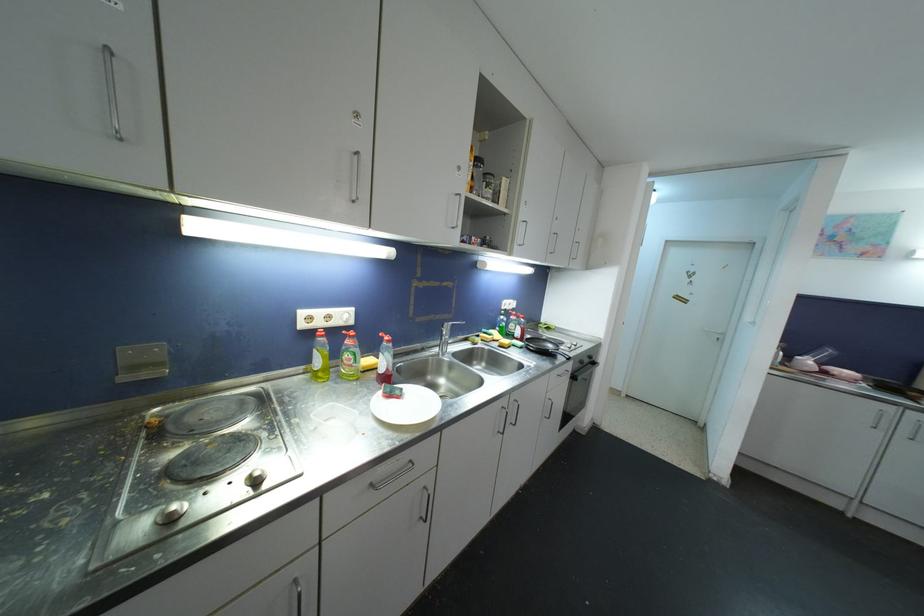
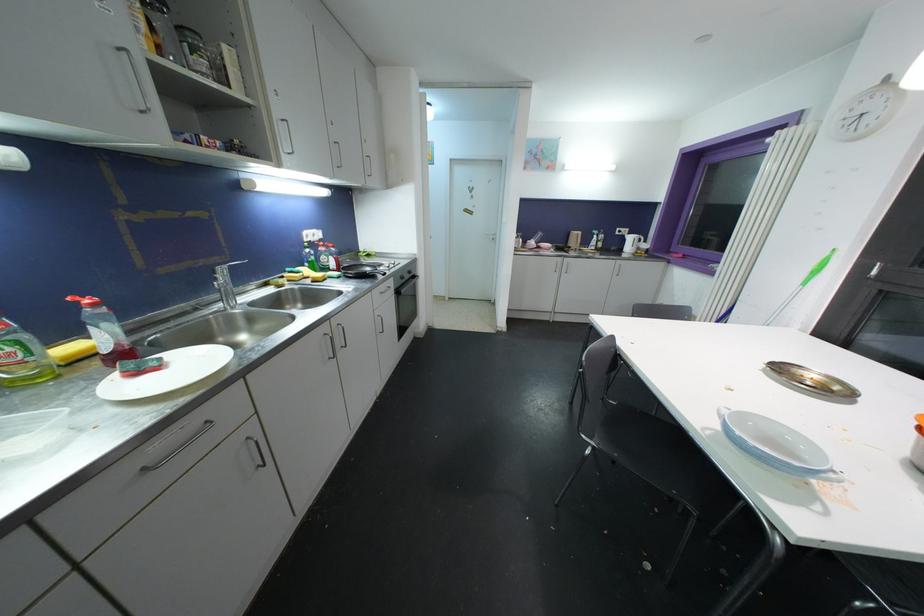
Find the pixel in the second image that matches (391,344) in the first image.

(98, 308)